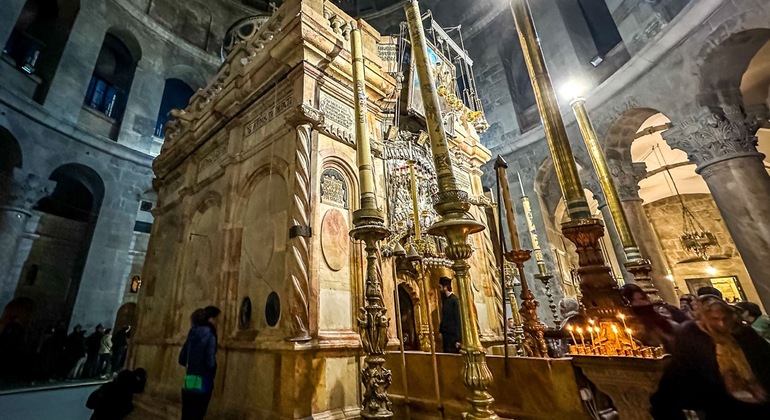
Locate an element on the screen. The image size is (770, 420). floor is located at coordinates (37, 396).